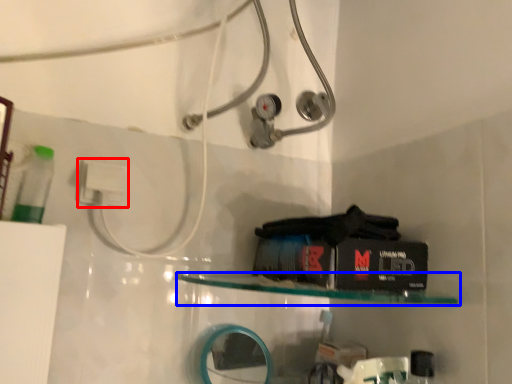
Question: Which object appears farthest to the camera in this image, electric outlet (highlighted by a red box) or shelf (highlighted by a blue box)?

Choices:
 (A) electric outlet
 (B) shelf

Answer: (A)